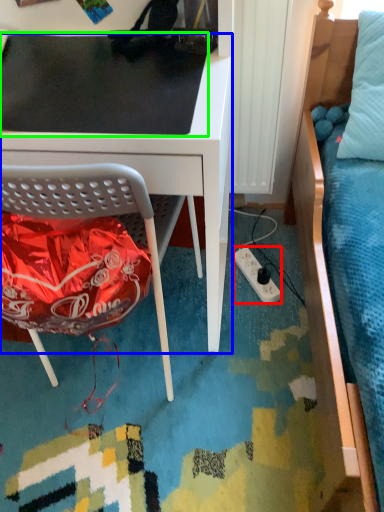
Question: Which object is positioned closest to power outlet (highlighted by a red box)? Select from desk (highlighted by a blue box) and table top (highlighted by a green box).

Choices:
 (A) desk
 (B) table top

Answer: (A)